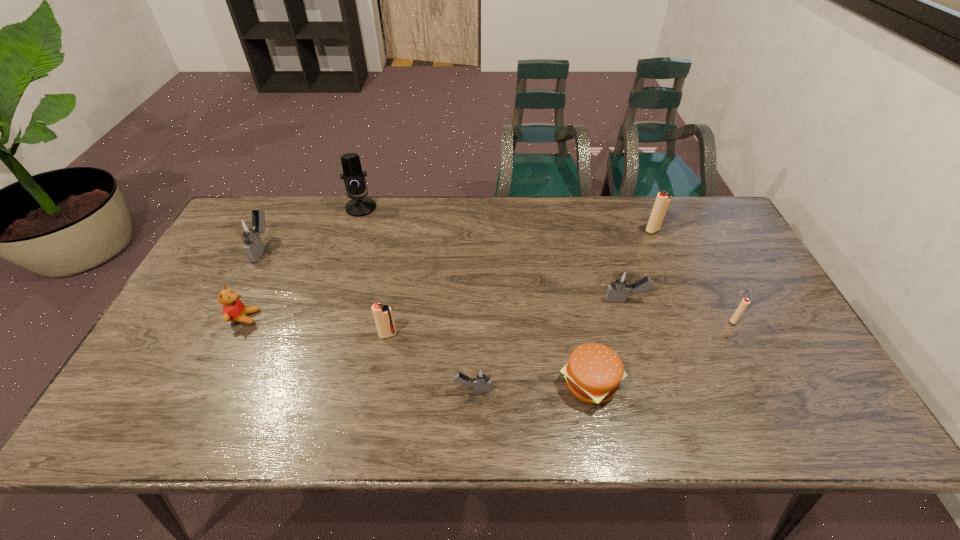
In order to click on teddy bear in this screenshot , I will do `click(234, 310)`.

Locate an element on the screen. The height and width of the screenshot is (540, 960). the rightmost red igniter is located at coordinates (743, 305).

Locate an element on the screen. the rightmost object is located at coordinates (743, 305).

Identify the location of the smallest gray igniter. (481, 378).

Image resolution: width=960 pixels, height=540 pixels. I want to click on the fourth igniter from right to left, so tap(481, 378).

Locate an element on the screen. The height and width of the screenshot is (540, 960). the sixth object from left to right is located at coordinates (593, 374).

Locate an element on the screen. free location located on the stand of the third object from left to right is located at coordinates click(x=352, y=237).

Locate an element on the screen. The height and width of the screenshot is (540, 960). vacant space located 0.050m on the back of the second red igniter from left to right is located at coordinates (647, 217).

Where is `free space located on the right of the farthest gray igniter`? The height and width of the screenshot is (540, 960). free space located on the right of the farthest gray igniter is located at coordinates (358, 248).

Identify the location of vacant position located on the right of the second biggest gray igniter. Image resolution: width=960 pixels, height=540 pixels. (744, 300).